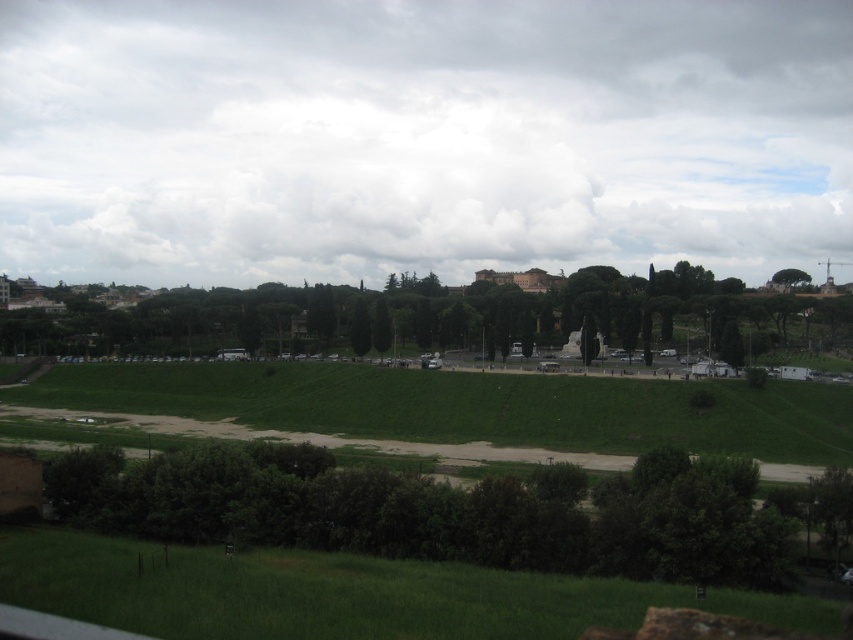
You are standing at the viewpoint of the image and see two points marked in the scene. Which point is nearer to you, point at coordinate (97,492) or point at coordinate (115,387)?

Point at coordinate (97,492) is closer to the viewer than point at coordinate (115,387).

You are planning to place a picnic blanket in the scene. The picnic blanket is 2 meters wide. You want to place it under the green leafy tree at lower center and the green grassy hillside at center. Which object can accommodate the width of the picnic blanket?

The green grassy hillside at center can accommodate the picnic blanket since its width is greater than the green leafy tree at lower center, which is narrower than 2 meters.